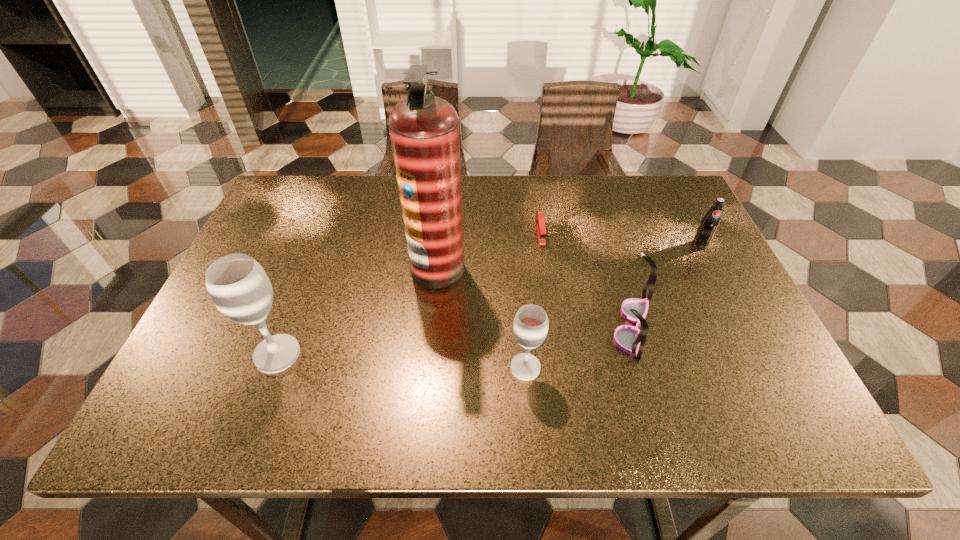
This screenshot has height=540, width=960. Find the location of `object that is at the near left corner`. object that is at the near left corner is located at coordinates (x=239, y=287).

In the image, there is a desktop. At what (x,y) coordinates should I click in order to perform the action: click on free space at the far edge. Please return your answer as a coordinate pair (x, y). Image resolution: width=960 pixels, height=540 pixels. Looking at the image, I should click on (562, 192).

This screenshot has height=540, width=960. In order to click on vacant space at the near edge of the desktop in this screenshot , I will do `click(281, 383)`.

In the image, there is a desktop. At what (x,y) coordinates should I click in order to perform the action: click on vacant space at the left edge. Please return your answer as a coordinate pair (x, y). Looking at the image, I should click on [300, 257].

In the image, there is a desktop. What are the coordinates of `vacant space at the right edge` in the screenshot? It's located at (692, 266).

In the image, there is a desktop. Where is `vacant space at the far left corner`? vacant space at the far left corner is located at coordinates (302, 175).

In order to click on blank space at the near right corner of the desktop in this screenshot , I will do `click(777, 369)`.

Where is `unoccupied position between the third object from right to left and the pop`? The width and height of the screenshot is (960, 540). unoccupied position between the third object from right to left and the pop is located at coordinates pyautogui.click(x=620, y=238).

Find the location of `free space between the shortest object and the fifth shortest object`. free space between the shortest object and the fifth shortest object is located at coordinates (409, 293).

I want to click on vacant area that lies between the left wineglass and the fifth object from left to right, so click(455, 340).